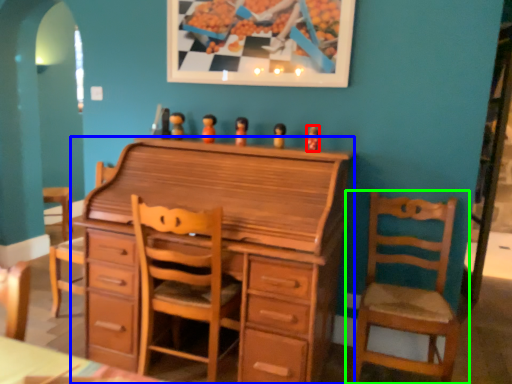
Question: Which object is the farthest from toy (highlighted by a red box)? Choose among these: chest of drawers (highlighted by a blue box) or chair (highlighted by a green box).

Choices:
 (A) chest of drawers
 (B) chair

Answer: (B)